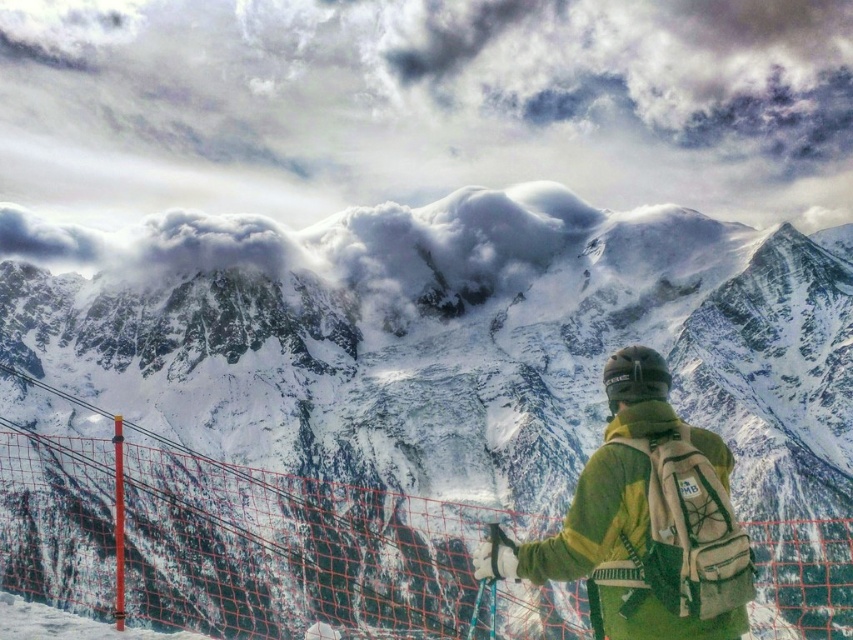
Who is shorter, snowy mountain at center or red mesh fence at center?

With less height is red mesh fence at center.

Can you confirm if snowy mountain at center is bigger than red mesh fence at center?

Correct, snowy mountain at center is larger in size than red mesh fence at center.

Measure the distance between point (393, 448) and camera.

Point (393, 448) and camera are 127.91 meters apart.

At what (x,y) coordinates should I click in order to perform the action: click on snowy mountain at center. Please return your answer as a coordinate pair (x, y). The image size is (853, 640). Looking at the image, I should click on (451, 339).

Is snowy mountain at center below green fleece jacket at lower right?

No.

The image size is (853, 640). What are the coordinates of `snowy mountain at center` in the screenshot? It's located at (451, 339).

The image size is (853, 640). In order to click on snowy mountain at center in this screenshot , I will do `click(451, 339)`.

Is point (187, 618) closer to viewer compared to point (613, 627)?

No, (187, 618) is behind (613, 627).

Is red mesh fence at center below green fleece jacket at lower right?

Indeed, red mesh fence at center is positioned under green fleece jacket at lower right.

Is point (560, 595) in front of point (608, 502)?

No, it is behind (608, 502).

Locate an element on the screen. Image resolution: width=853 pixels, height=640 pixels. red mesh fence at center is located at coordinates (294, 552).